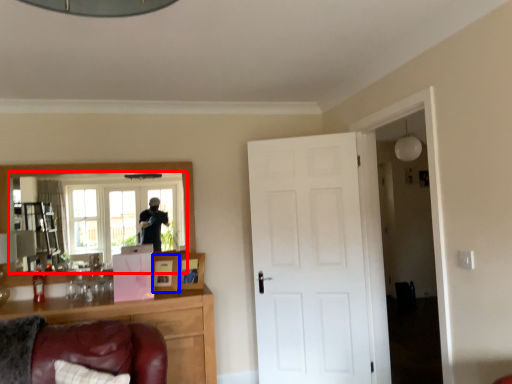
Question: Which object appears closest to the camera in this image, mirror (highlighted by a red box) or picture frame (highlighted by a blue box)?

Choices:
 (A) mirror
 (B) picture frame

Answer: (A)